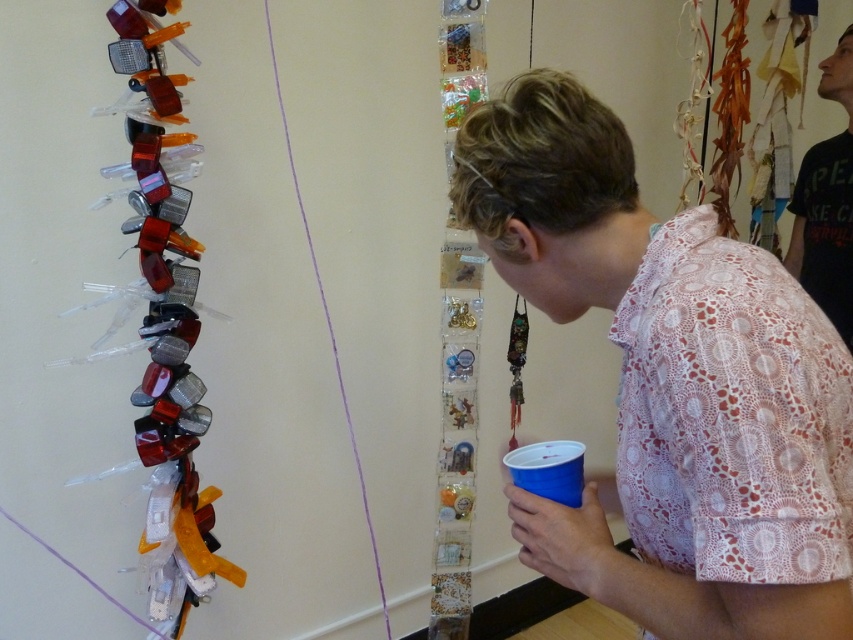
Based on the photo, you are organizing a clothing donation drive and need to determine which shirt takes up more space when folded. Based on the image, which of the two shirts, the pink lace shirt at center or the black cotton shirt at upper right, would require more storage space when folded?

The pink lace shirt at center might be wider than black cotton shirt at upper right, so it would likely require more storage space when folded.

You are standing in a room and see the pink lace shirt at center and the black cotton shirt at upper right. If you want to place a 1.5 meter long banner between them, will it fit without bending?

The distance between the pink lace shirt at center and the black cotton shirt at upper right is 1.64 meters. Since the banner is 1.5 meters long, it will fit between them without bending.